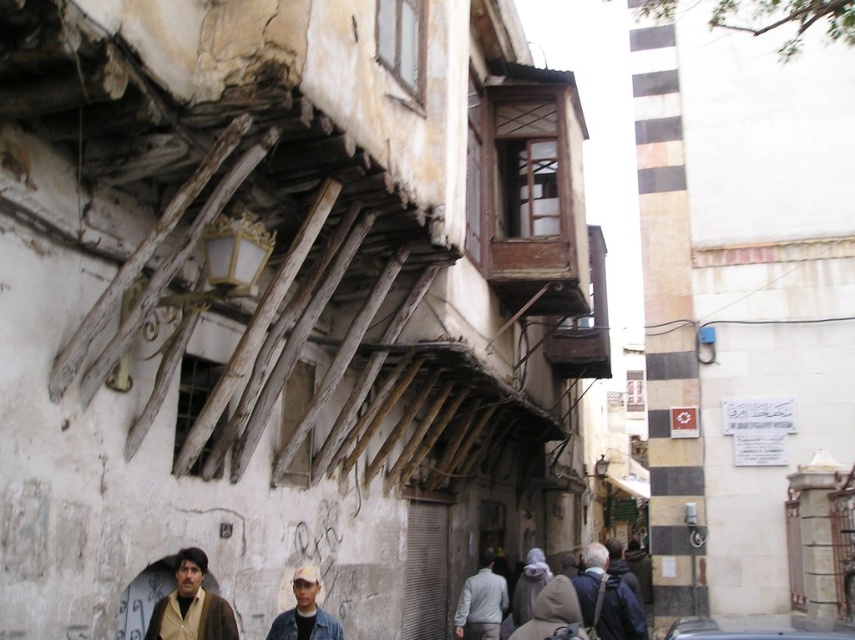
Question: Which of the following is the closest to the observer?

Choices:
 (A) metallic silver car at center
 (B) dark blue jacket at lower right
 (C) denim jacket at lower center
 (D) beige woolen jacket at lower left

Answer: (A)

Question: Among these objects, which one is farthest from the camera?

Choices:
 (A) light gray fabric jacket at center
 (B) denim jacket at lower center

Answer: (A)

Question: Is dark blue jacket at lower right wider than light gray fabric jacket at center?

Choices:
 (A) no
 (B) yes

Answer: (B)

Question: Observing the image, what is the correct spatial positioning of metallic silver car at center in reference to light gray fabric jacket at center?

Choices:
 (A) right
 (B) left

Answer: (A)

Question: Does beige woolen jacket at lower left lie in front of light gray fabric jacket at center?

Choices:
 (A) yes
 (B) no

Answer: (A)

Question: Which of these objects is positioned closest to the light gray fabric jacket at center?

Choices:
 (A) dark blue jacket at lower right
 (B) beige woolen jacket at lower left
 (C) metallic silver car at center

Answer: (A)